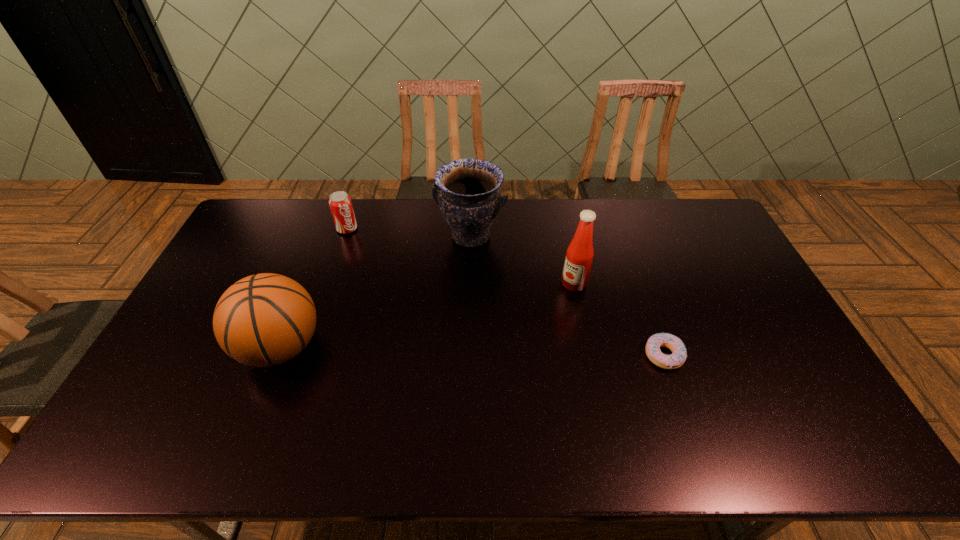
Image resolution: width=960 pixels, height=540 pixels. In order to click on object located in the near edge section of the desktop in this screenshot , I will do `click(263, 320)`.

Find the location of a particular element. vacant space at the far edge is located at coordinates (396, 224).

In the image, there is a desktop. At what (x,y) coordinates should I click in order to perform the action: click on vacant space at the near edge. Please return your answer as a coordinate pair (x, y). Image resolution: width=960 pixels, height=540 pixels. Looking at the image, I should click on (481, 387).

In the image, there is a desktop. Where is `free space at the left edge`? The width and height of the screenshot is (960, 540). free space at the left edge is located at coordinates (216, 304).

I want to click on vacant area at the right edge, so click(x=750, y=284).

In the image, there is a desktop. Identify the location of free space at the far left corner. This screenshot has height=540, width=960. (268, 211).

At what (x,y) coordinates should I click in order to perform the action: click on free space at the near left corner of the desktop. Please return your answer as a coordinate pair (x, y). This screenshot has width=960, height=540. Looking at the image, I should click on (180, 392).

Locate an element on the screen. Image resolution: width=960 pixels, height=540 pixels. empty space between the fourth tallest object and the rightmost object is located at coordinates (505, 292).

I want to click on empty space between the pottery and the basketball, so click(375, 292).

This screenshot has width=960, height=540. Find the location of `unoccupied position between the rightmost object and the pottery`. unoccupied position between the rightmost object and the pottery is located at coordinates (567, 296).